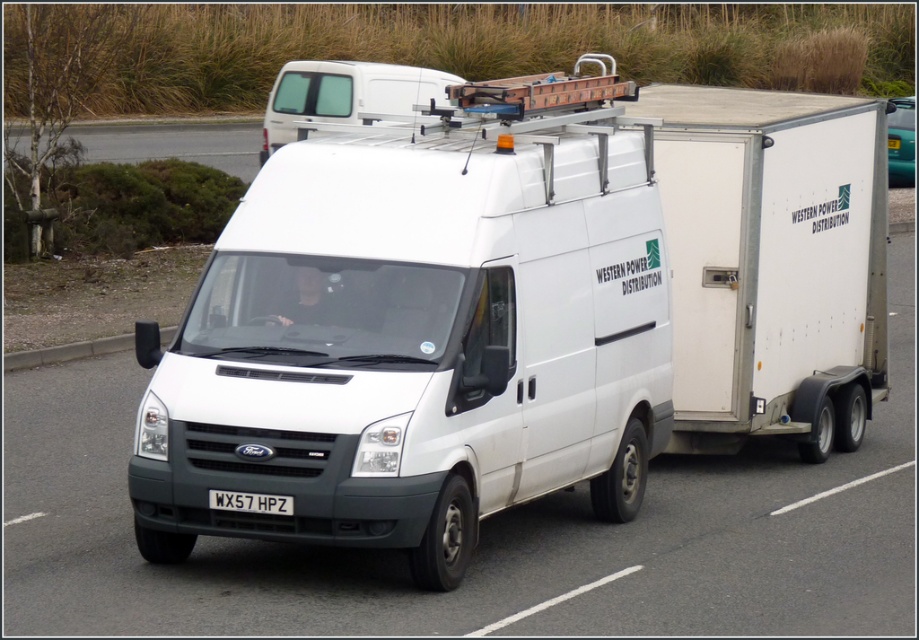
Question: Considering the real-world distances, which object is farthest from the white matte van at upper center?

Choices:
 (A) white matte trailer truck at center
 (B) asphalt road at upper center
 (C) white matte van at center
 (D) white plastic license plate at center

Answer: (D)

Question: Considering the real-world distances, which object is closest to the asphalt road at upper center?

Choices:
 (A) white matte trailer truck at center
 (B) white matte van at center
 (C) white matte van at upper center

Answer: (C)

Question: Can you confirm if white matte trailer truck at center is wider than white matte van at upper center?

Choices:
 (A) yes
 (B) no

Answer: (B)

Question: Can you confirm if white matte trailer truck at center is bigger than white matte van at upper center?

Choices:
 (A) yes
 (B) no

Answer: (B)

Question: Is white matte van at center to the left of white matte van at upper center from the viewer's perspective?

Choices:
 (A) no
 (B) yes

Answer: (A)

Question: Which point is closer to the camera taking this photo?

Choices:
 (A) (219, 124)
 (B) (546, 426)
 (C) (264, 509)

Answer: (C)